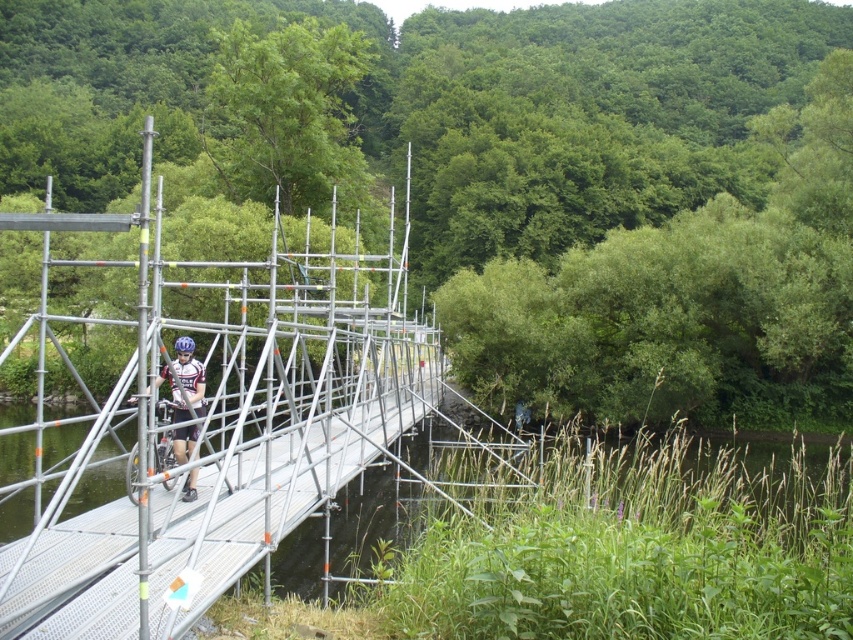
Which of these two, metal scaffolding at center or matte black bicycle at center, stands taller?

metal scaffolding at center is taller.

Locate an element on the screen. The image size is (853, 640). metal scaffolding at center is located at coordinates (207, 416).

Find the location of a particular element. The height and width of the screenshot is (640, 853). metal scaffolding at center is located at coordinates tap(207, 416).